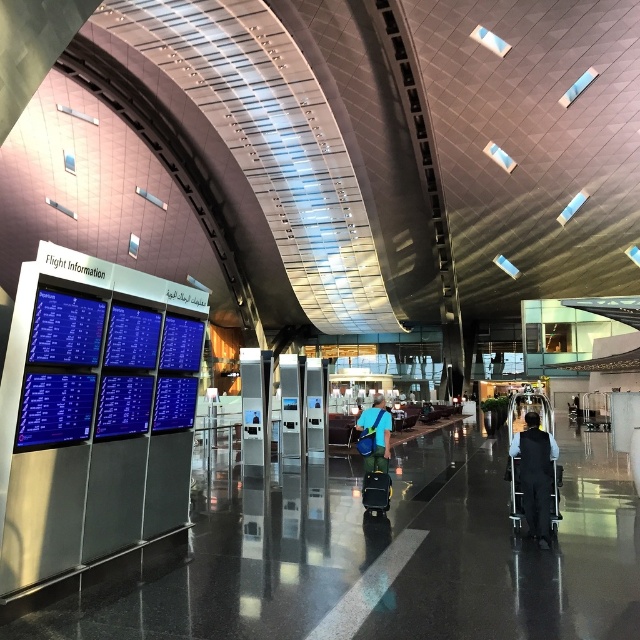
Question: Does dark blue uniform at center have a larger size compared to blue fabric backpack at center?

Choices:
 (A) yes
 (B) no

Answer: (B)

Question: Can you confirm if dark blue uniform at center is thinner than blue fabric backpack at center?

Choices:
 (A) no
 (B) yes

Answer: (B)

Question: Which object is closer to the camera taking this photo?

Choices:
 (A) dark blue uniform at center
 (B) blue fabric backpack at center
 (C) black textured suitcase at center

Answer: (A)

Question: Which of these objects is positioned closest to the black textured suitcase at center?

Choices:
 (A) blue fabric backpack at center
 (B) dark blue uniform at center

Answer: (A)

Question: Observing the image, what is the correct spatial positioning of dark blue uniform at center in reference to black textured suitcase at center?

Choices:
 (A) below
 (B) above

Answer: (B)

Question: Among these objects, which one is nearest to the camera?

Choices:
 (A) dark blue uniform at center
 (B) black textured suitcase at center

Answer: (A)